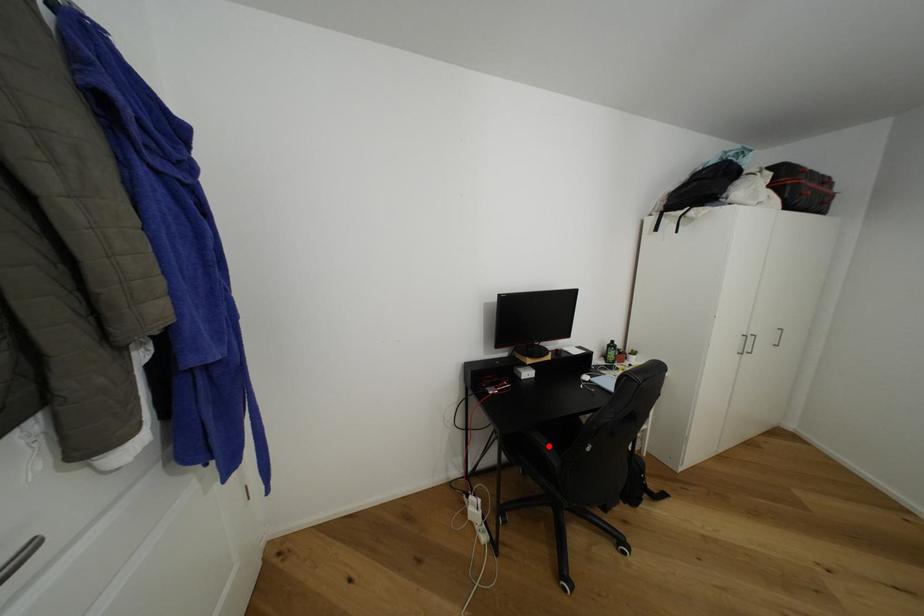
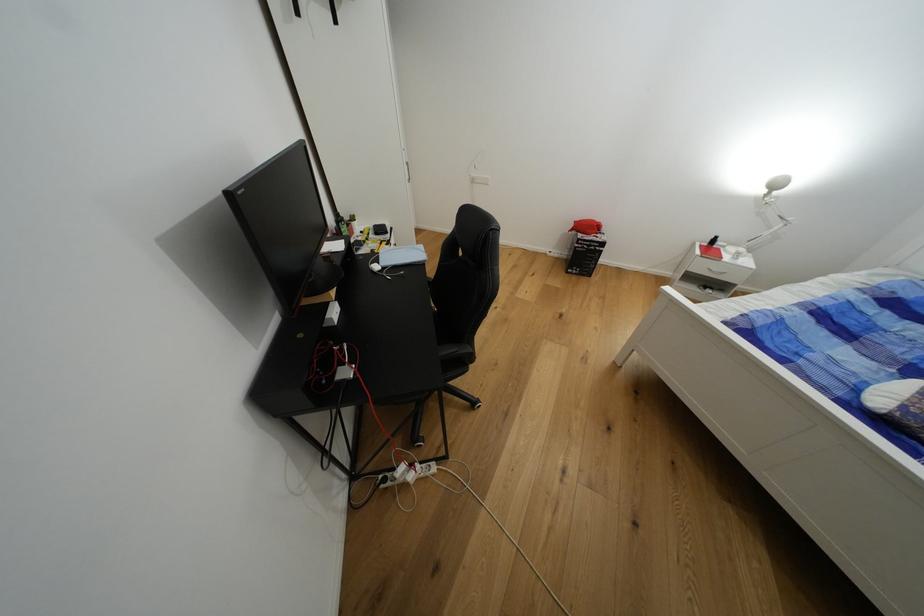
Question: I am providing you with two images of the same scene from different viewpoints. Given a red point in image1, look at the same physical point in image2. Is it:

Choices:
 (A) Closer to the viewpoint
 (B) Farther from the viewpoint

Answer: (B)